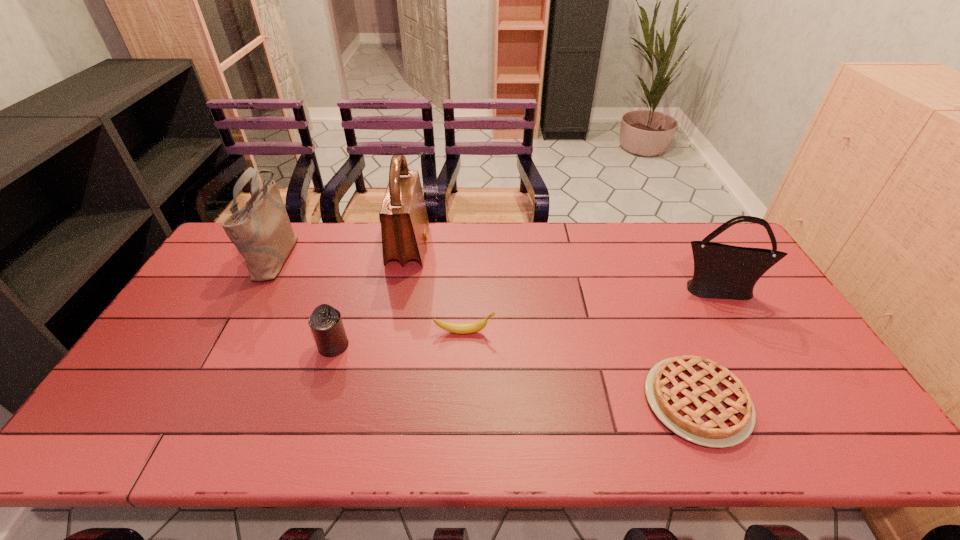
In the image, there is a desktop. In order to click on vacant space at the far edge in this screenshot , I will do `click(354, 252)`.

Where is `vacant space at the near edge of the desktop`? The width and height of the screenshot is (960, 540). vacant space at the near edge of the desktop is located at coordinates (762, 424).

The image size is (960, 540). I want to click on vacant space at the right edge, so click(824, 378).

At what (x,y) coordinates should I click in order to perform the action: click on vacant space at the far left corner of the desktop. Please return your answer as a coordinate pair (x, y). The width and height of the screenshot is (960, 540). Looking at the image, I should click on (245, 259).

Find the location of a particular element. Image resolution: width=960 pixels, height=540 pixels. vacant space at the far right corner of the desktop is located at coordinates (708, 228).

Find the location of a particular element. The image size is (960, 540). vacant area at the near right corner is located at coordinates (878, 449).

This screenshot has height=540, width=960. In order to click on free space between the second object from left to right and the third tallest object in this screenshot , I will do `click(525, 318)`.

Find the location of a particular element. free space between the shortest shoulder bag and the leftmost object is located at coordinates (497, 272).

In order to click on unoccupied position between the second shortest object and the shortest shoulder bag in this screenshot , I will do `click(590, 311)`.

Find the location of a particular element. Image resolution: width=960 pixels, height=540 pixels. vacant area between the rightmost shoulder bag and the second shoulder bag from left to right is located at coordinates (563, 268).